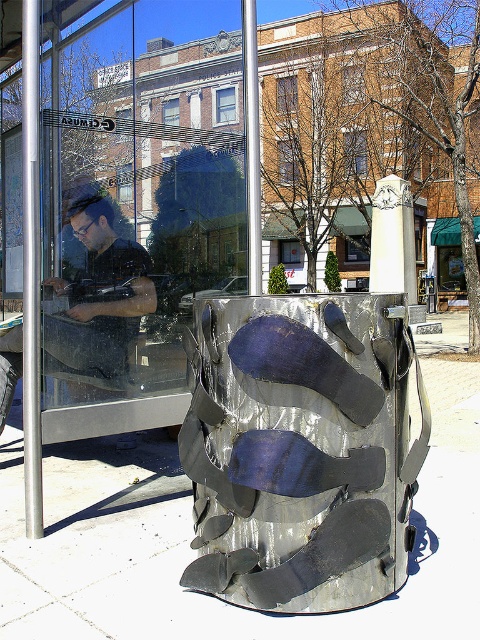
You are standing at the bus stop and notice a metallic silver sculpture at center and a matte black shirt at left. Which object is positioned to the right of the other?

The metallic silver sculpture at center is to the right of the matte black shirt at left.

You are a delivery person trying to find the bus stop. You see the transparent glass at center and the matte black shirt at left. Which object is higher up from the ground?

The transparent glass at center is much taller than the matte black shirt at left, so the transparent glass at center is higher up from the ground.

You are standing at the bus stop and looking at the metallic silver sculpture at center and the matte black shirt at left. Which object appears shorter in height?

The metallic silver sculpture at center is not as tall as the matte black shirt at left, so the sculpture appears shorter.